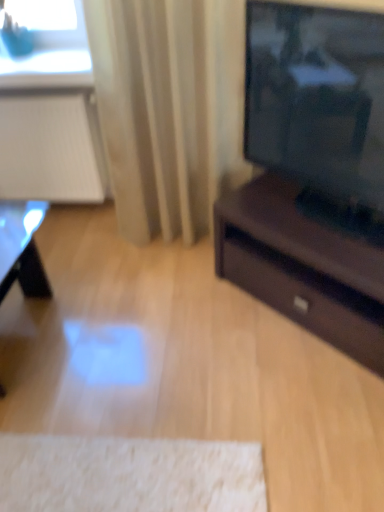
Where is `free space below shiny black table at lower left (from a real-world perspective)`? free space below shiny black table at lower left (from a real-world perspective) is located at coordinates (22, 336).